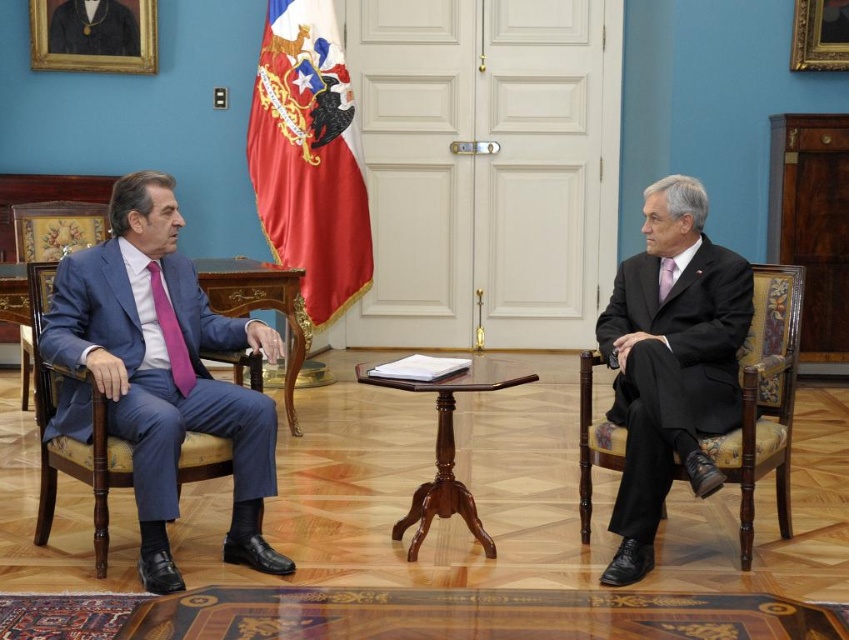
Which is more to the right, mahogany wood table at center or wooden polished table at center?

From the viewer's perspective, mahogany wood table at center appears more on the right side.

Is point (428, 483) behind point (291, 305)?

No.

At what (x,y) coordinates should I click in order to perform the action: click on mahogany wood table at center. Please return your answer as a coordinate pair (x, y). Looking at the image, I should click on tap(447, 449).

Can you confirm if red fabric flag at upper center is shorter than blue upholstered chair at left?

Incorrect, red fabric flag at upper center's height does not fall short of blue upholstered chair at left's.

Describe the element at coordinates (308, 157) in the screenshot. The width and height of the screenshot is (849, 640). I see `red fabric flag at upper center` at that location.

This screenshot has height=640, width=849. I want to click on red fabric flag at upper center, so click(308, 157).

Measure the distance from velvet upholstered chair at right to pink satin tie at right.

They are 21.98 inches apart.

Can you confirm if velvet upholstered chair at right is thinner than pink satin tie at right?

In fact, velvet upholstered chair at right might be wider than pink satin tie at right.

Is point (782, 333) positioned in front of point (668, 278)?

Yes, point (782, 333) is closer to viewer.

Identify the location of velvet upholstered chair at right. (765, 397).